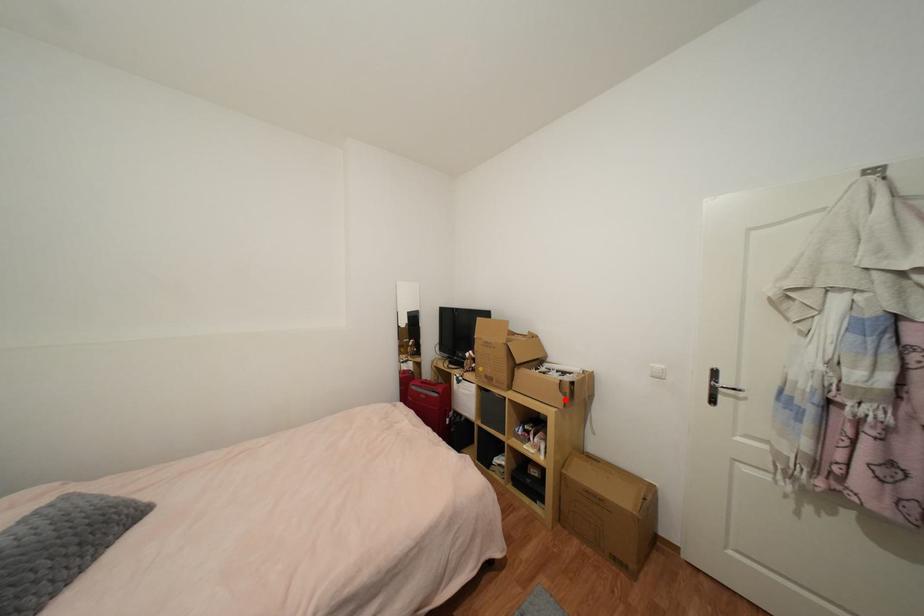
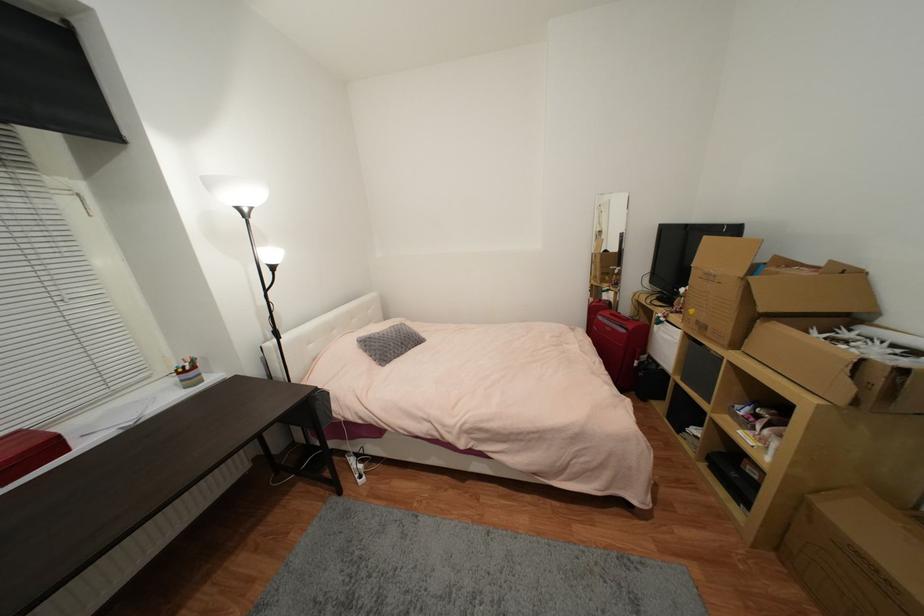
Where in the second image is the point corresponding to the highlighted location from the first image?

(852, 390)